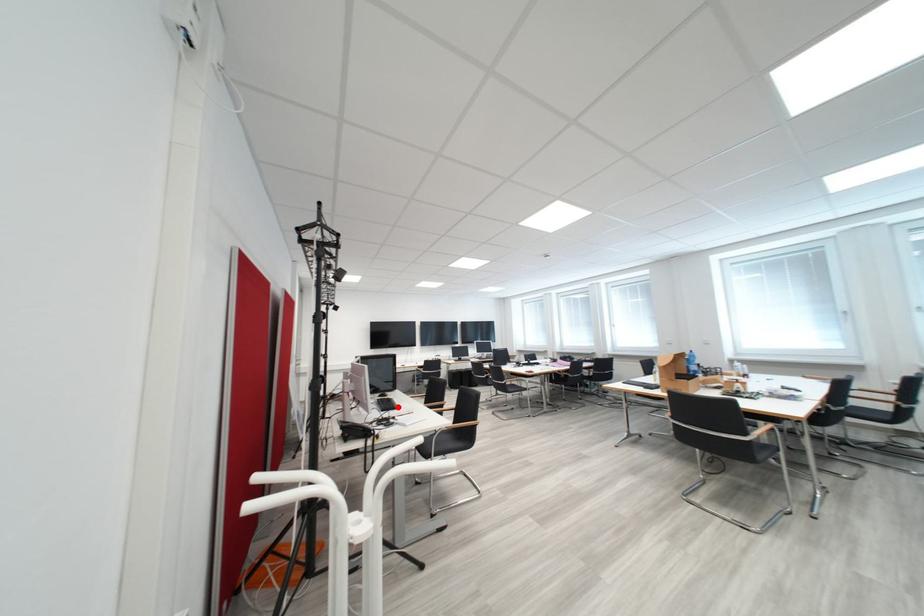
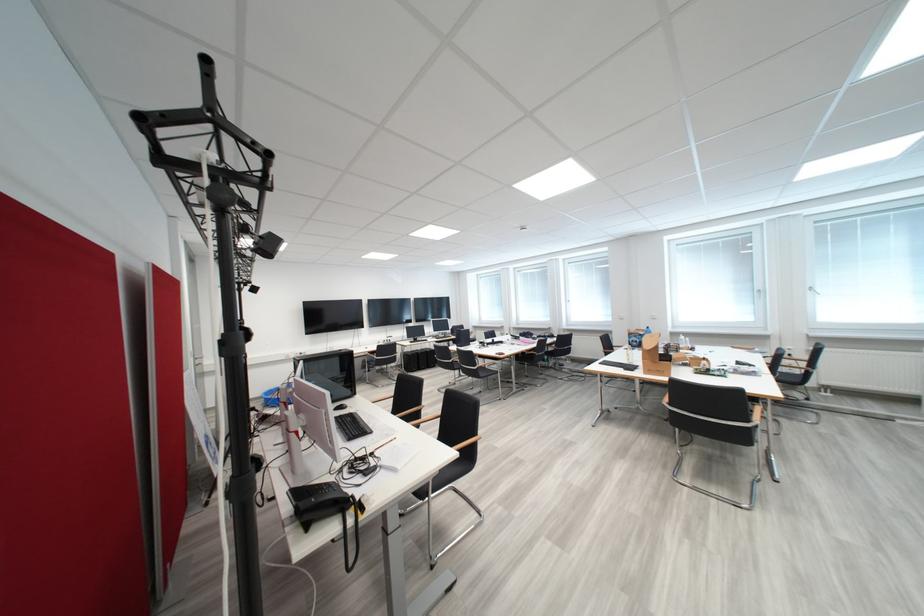
Question: I am providing you with two images of the same scene from different viewpoints. Given a red point in image1, look at the same physical point in image2. Is it:

Choices:
 (A) Closer to the viewpoint
 (B) Farther from the viewpoint

Answer: (B)